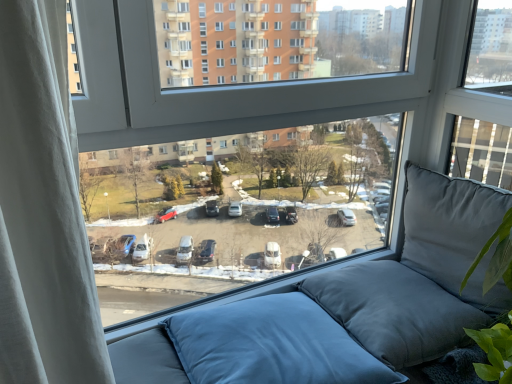
The image size is (512, 384). Describe the element at coordinates (453, 233) in the screenshot. I see `matte gray cushion at right, marked as the 1th pillow in a right-to-left arrangement` at that location.

Describe the element at coordinates (273, 87) in the screenshot. Image resolution: width=512 pixels, height=384 pixels. I see `transparent glass window at center` at that location.

The width and height of the screenshot is (512, 384). I want to click on transparent glass window at center, so click(273, 87).

You are a GUI agent. You are given a task and a screenshot of the screen. Output one action in this format:
    pyautogui.click(x=<x>, y=<y>)
    Task: Click on the blue fabric pillow at lower center, which ranks as the 2th pillow in right-to-left order
    The image size is (512, 384).
    Given the screenshot: What is the action you would take?
    pyautogui.click(x=272, y=345)

Who is bigger, transparent glass window at center or blue fabric pillow at lower center, which ranks as the 2th pillow in right-to-left order?

With larger size is transparent glass window at center.

How distant is transparent glass window at center from blue fabric pillow at lower center, the first pillow from the left?

A distance of 23.51 inches exists between transparent glass window at center and blue fabric pillow at lower center, the first pillow from the left.

Is transparent glass window at center outside of blue fabric pillow at lower center, which ranks as the 2th pillow in right-to-left order?

Indeed, transparent glass window at center is completely outside blue fabric pillow at lower center, which ranks as the 2th pillow in right-to-left order.

Who is shorter, transparent glass window at center or blue fabric pillow at lower center, which ranks as the 2th pillow in right-to-left order?

blue fabric pillow at lower center, which ranks as the 2th pillow in right-to-left order, is shorter.

Where is `window above the matte gray cushion at right, positioned as the second pillow in left-to-right order (from the image's perspective)`? The width and height of the screenshot is (512, 384). window above the matte gray cushion at right, positioned as the second pillow in left-to-right order (from the image's perspective) is located at coordinates (273, 87).

Consider the image. Considering the sizes of objects transparent glass window at center and matte gray cushion at right, positioned as the second pillow in left-to-right order, in the image provided, who is thinner, transparent glass window at center or matte gray cushion at right, positioned as the second pillow in left-to-right order,?

With smaller width is transparent glass window at center.

Is point (78, 129) positioned in front of point (418, 179)?

Yes, point (78, 129) is in front of point (418, 179).

Is transparent glass window at center not inside matte gray cushion at right, positioned as the second pillow in left-to-right order?

Yes.

Is transparent glass window at center inside matte gray cushion at right, positioned as the second pillow in left-to-right order?

Actually, transparent glass window at center is outside matte gray cushion at right, positioned as the second pillow in left-to-right order.

Is matte gray cushion at right, positioned as the second pillow in left-to-right order, shorter than transparent glass window at center?

Yes.

Looking at their sizes, would you say matte gray cushion at right, marked as the 1th pillow in a right-to-left arrangement, is wider or thinner than transparent glass window at center?

Considering their sizes, matte gray cushion at right, marked as the 1th pillow in a right-to-left arrangement, looks broader than transparent glass window at center.

From a real-world perspective, is blue fabric pillow at lower center, the first pillow from the left, physically located above or below matte gray cushion at right, marked as the 1th pillow in a right-to-left arrangement?

Clearly, from a real-world perspective, blue fabric pillow at lower center, the first pillow from the left, is below matte gray cushion at right, marked as the 1th pillow in a right-to-left arrangement.

Who is bigger, blue fabric pillow at lower center, the first pillow from the left, or matte gray cushion at right, positioned as the second pillow in left-to-right order?

blue fabric pillow at lower center, the first pillow from the left.

Does point (219, 361) lie in front of point (482, 261)?

No, (219, 361) is behind (482, 261).

Looking at this image, considering the relative positions of matte gray cushion at right, positioned as the second pillow in left-to-right order, and blue fabric pillow at lower center, which ranks as the 2th pillow in right-to-left order, in the image provided, is matte gray cushion at right, positioned as the second pillow in left-to-right order, to the right of blue fabric pillow at lower center, which ranks as the 2th pillow in right-to-left order, from the viewer's perspective?

Indeed, matte gray cushion at right, positioned as the second pillow in left-to-right order, is positioned on the right side of blue fabric pillow at lower center, which ranks as the 2th pillow in right-to-left order.

Consider the image. Is matte gray cushion at right, marked as the 1th pillow in a right-to-left arrangement, with blue fabric pillow at lower center, which ranks as the 2th pillow in right-to-left order?

matte gray cushion at right, marked as the 1th pillow in a right-to-left arrangement, and blue fabric pillow at lower center, which ranks as the 2th pillow in right-to-left order, are not in contact.

Is matte gray cushion at right, marked as the 1th pillow in a right-to-left arrangement, completely or partially outside of blue fabric pillow at lower center, the first pillow from the left?

Yes, matte gray cushion at right, marked as the 1th pillow in a right-to-left arrangement, is outside of blue fabric pillow at lower center, the first pillow from the left.

Can you tell me how much matte gray cushion at right, positioned as the second pillow in left-to-right order, and blue fabric pillow at lower center, which ranks as the 2th pillow in right-to-left order, differ in facing direction?

The facing directions of matte gray cushion at right, positioned as the second pillow in left-to-right order, and blue fabric pillow at lower center, which ranks as the 2th pillow in right-to-left order, are 85.6 degrees apart.

Does blue fabric pillow at lower center, which ranks as the 2th pillow in right-to-left order, touch transparent glass window at center?

No, blue fabric pillow at lower center, which ranks as the 2th pillow in right-to-left order, is not with transparent glass window at center.

From the image's perspective, is blue fabric pillow at lower center, the first pillow from the left, above or below transparent glass window at center?

blue fabric pillow at lower center, the first pillow from the left, is situated lower than transparent glass window at center in the image.

In the image, is blue fabric pillow at lower center, which ranks as the 2th pillow in right-to-left order, on the left side or the right side of transparent glass window at center?

From the image, it's evident that blue fabric pillow at lower center, which ranks as the 2th pillow in right-to-left order, is to the left of transparent glass window at center.

Is blue fabric pillow at lower center, the first pillow from the left, facing towards transparent glass window at center?

No, blue fabric pillow at lower center, the first pillow from the left, does not turn towards transparent glass window at center.

Where is `pillow on the left of the transparent glass window at center`? The width and height of the screenshot is (512, 384). pillow on the left of the transparent glass window at center is located at coordinates (272, 345).

The height and width of the screenshot is (384, 512). Find the location of `window in front of the matte gray cushion at right, marked as the 1th pillow in a right-to-left arrangement`. window in front of the matte gray cushion at right, marked as the 1th pillow in a right-to-left arrangement is located at coordinates (273, 87).

Looking at the image, which one is located further to blue fabric pillow at lower center, which ranks as the 2th pillow in right-to-left order, transparent glass window at center or matte gray cushion at right, positioned as the second pillow in left-to-right order?

The object further to blue fabric pillow at lower center, which ranks as the 2th pillow in right-to-left order, is transparent glass window at center.

Based on their spatial positions, is matte gray cushion at right, marked as the 1th pillow in a right-to-left arrangement, or transparent glass window at center further from blue fabric pillow at lower center, which ranks as the 2th pillow in right-to-left order?

transparent glass window at center.

Considering their positions, is transparent glass window at center positioned closer to matte gray cushion at right, positioned as the second pillow in left-to-right order, than blue fabric pillow at lower center, which ranks as the 2th pillow in right-to-left order?

Based on the image, transparent glass window at center appears to be nearer to matte gray cushion at right, positioned as the second pillow in left-to-right order.

Based on their spatial positions, is matte gray cushion at right, positioned as the second pillow in left-to-right order, or blue fabric pillow at lower center, which ranks as the 2th pillow in right-to-left order, closer to transparent glass window at center?

matte gray cushion at right, positioned as the second pillow in left-to-right order, is closer to transparent glass window at center.

Which object lies further to the anchor point transparent glass window at center, blue fabric pillow at lower center, which ranks as the 2th pillow in right-to-left order, or matte gray cushion at right, marked as the 1th pillow in a right-to-left arrangement?

Among the two, blue fabric pillow at lower center, which ranks as the 2th pillow in right-to-left order, is located further to transparent glass window at center.

When comparing their distances from matte gray cushion at right, marked as the 1th pillow in a right-to-left arrangement, does blue fabric pillow at lower center, which ranks as the 2th pillow in right-to-left order, or transparent glass window at center seem further?

blue fabric pillow at lower center, which ranks as the 2th pillow in right-to-left order, is positioned further to the anchor matte gray cushion at right, marked as the 1th pillow in a right-to-left arrangement.

Locate an element on the screen. This screenshot has height=384, width=512. window between blue fabric pillow at lower center, which ranks as the 2th pillow in right-to-left order, and matte gray cushion at right, positioned as the second pillow in left-to-right order, in the horizontal direction is located at coordinates (273, 87).